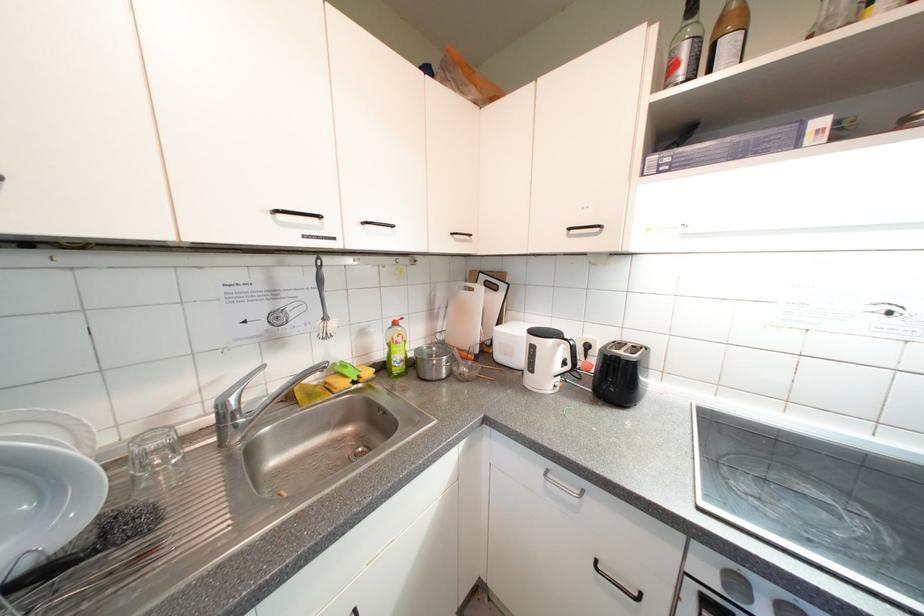
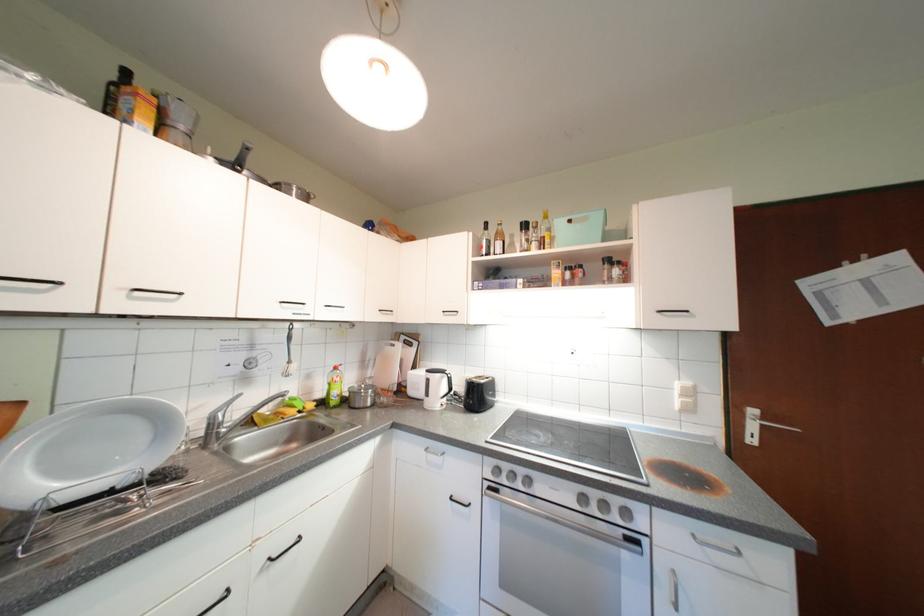
In the second image, find the point that corresponds to pixel 402 351 in the first image.

(341, 389)